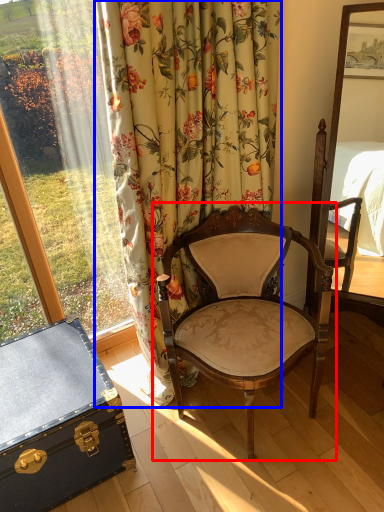
Question: Which point is further to the camera, chair (highlighted by a red box) or curtain (highlighted by a blue box)?

Choices:
 (A) chair
 (B) curtain

Answer: (A)